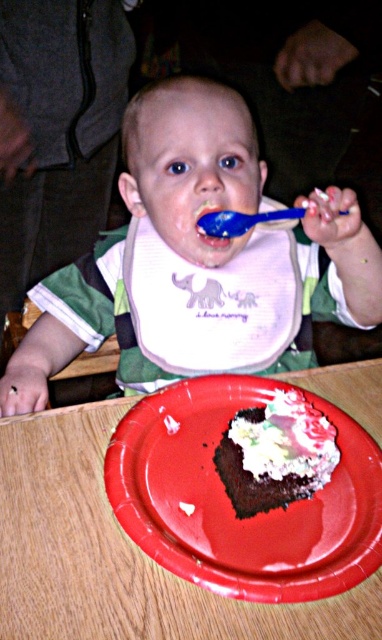
Question: From the image, what is the correct spatial relationship of smooth red paper plate at lower center in relation to chocolatesmoothcake at center?

Choices:
 (A) right
 (B) left

Answer: (B)

Question: Does blue plastic spoon at upper center have a lesser width compared to blue glossy toothbrush at center?

Choices:
 (A) yes
 (B) no

Answer: (B)

Question: Which point is farther from the camera taking this photo?

Choices:
 (A) (242, 220)
 (B) (296, 420)
 (C) (281, 529)

Answer: (A)

Question: Does matte white bib at center come behind chocolatesmoothcake at center?

Choices:
 (A) no
 (B) yes

Answer: (B)

Question: Which object is positioned closest to the smooth red paper plate at lower center?

Choices:
 (A) matte white bib at center
 (B) blue plastic spoon at upper center

Answer: (A)

Question: Estimate the real-world distances between objects in this image. Which object is closer to the blue glossy toothbrush at center?

Choices:
 (A) blue plastic spoon at upper center
 (B) chocolatesmoothcake at center

Answer: (A)